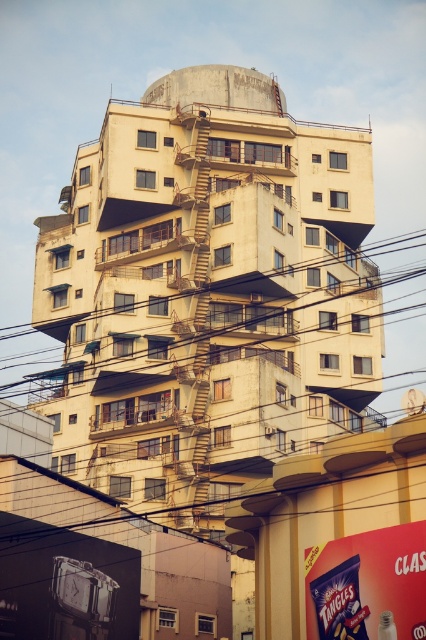
This screenshot has height=640, width=426. What do you see at coordinates (402, 307) in the screenshot?
I see `brown wire at center` at bounding box center [402, 307].

Find the location of a particular element. brown wire at center is located at coordinates (402, 307).

Which is in front, point (397, 388) or point (206, 179)?

Positioned in front is point (206, 179).

This screenshot has height=640, width=426. In order to click on brown wire at center in this screenshot , I will do `click(402, 307)`.